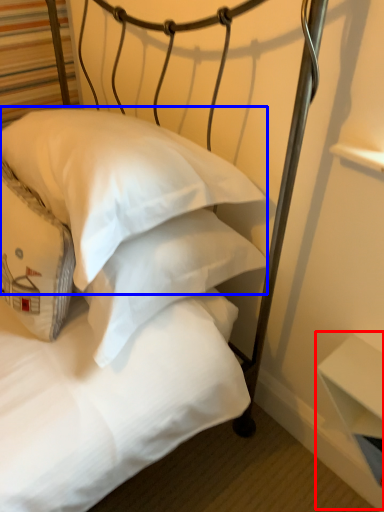
Question: Which of the following is the farthest to the observer, table (highlighted by a red box) or pillow (highlighted by a blue box)?

Choices:
 (A) table
 (B) pillow

Answer: (A)